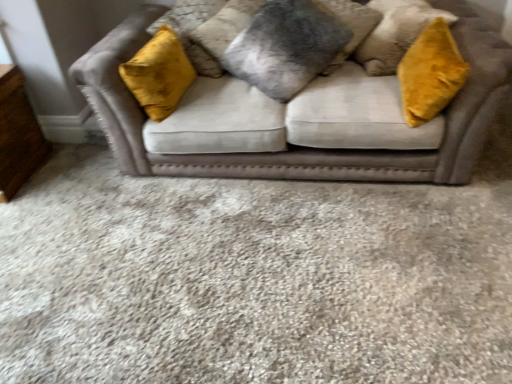
Question: Does wooden dresser at lower left have a smaller size compared to velvet beige couch at center?

Choices:
 (A) no
 (B) yes

Answer: (B)

Question: From the image's perspective, would you say wooden dresser at lower left is positioned over velvet beige couch at center?

Choices:
 (A) yes
 (B) no

Answer: (B)

Question: Is wooden dresser at lower left placed right next to velvet beige couch at center?

Choices:
 (A) yes
 (B) no

Answer: (B)

Question: Is wooden dresser at lower left shorter than velvet beige couch at center?

Choices:
 (A) no
 (B) yes

Answer: (B)

Question: From a real-world perspective, is wooden dresser at lower left on velvet beige couch at center?

Choices:
 (A) yes
 (B) no

Answer: (B)

Question: From the image's perspective, relative to wooden dresser at lower left, is velvet beige couch at center above or below?

Choices:
 (A) below
 (B) above

Answer: (B)

Question: Based on their positions, is velvet beige couch at center located to the left or right of wooden dresser at lower left?

Choices:
 (A) left
 (B) right

Answer: (B)

Question: From a real-world perspective, relative to wooden dresser at lower left, is velvet beige couch at center vertically above or below?

Choices:
 (A) below
 (B) above

Answer: (B)

Question: Does point (372, 81) appear closer or farther from the camera than point (11, 182)?

Choices:
 (A) farther
 (B) closer

Answer: (B)

Question: Looking at the image, does wooden dresser at lower left seem bigger or smaller compared to fuzzy gray pillow at center, which ranks as the first pillow in left-to-right order?

Choices:
 (A) small
 (B) big

Answer: (B)

Question: Is wooden dresser at lower left in front of or behind fuzzy gray pillow at center, which ranks as the first pillow in left-to-right order, in the image?

Choices:
 (A) behind
 (B) front

Answer: (B)

Question: Does point (13, 89) appear closer or farther from the camera than point (204, 46)?

Choices:
 (A) farther
 (B) closer

Answer: (B)

Question: From a real-world perspective, is wooden dresser at lower left above or below fuzzy gray pillow at center, which ranks as the first pillow in left-to-right order?

Choices:
 (A) above
 (B) below

Answer: (B)

Question: In the image, is velvet beige sofa at center positioned in front of or behind fuzzy gray pillow at center, which is the second pillow in right-to-left order?

Choices:
 (A) front
 (B) behind

Answer: (A)

Question: Visually, is velvet beige sofa at center positioned to the left or to the right of fuzzy gray pillow at center, which ranks as the first pillow in left-to-right order?

Choices:
 (A) right
 (B) left

Answer: (A)